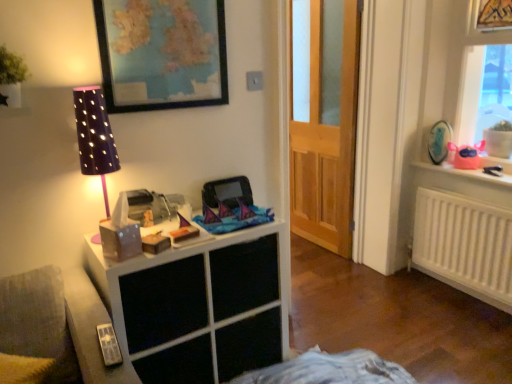
Question: Considering the relative sizes of gold metallic picture frame at upper right, which is the 1th picture frame from right to left, and pink plastic toy at upper right in the image provided, is gold metallic picture frame at upper right, which is the 1th picture frame from right to left, thinner than pink plastic toy at upper right?

Choices:
 (A) no
 (B) yes

Answer: (B)

Question: From a real-world perspective, is gold metallic picture frame at upper right, acting as the 3th picture frame starting from the bottom, located higher than pink plastic toy at upper right?

Choices:
 (A) no
 (B) yes

Answer: (B)

Question: Does gold metallic picture frame at upper right, arranged as the 2th picture frame when viewed from the front, have a lesser height compared to pink plastic toy at upper right?

Choices:
 (A) yes
 (B) no

Answer: (A)

Question: Is gold metallic picture frame at upper right, positioned as the second picture frame in back-to-front order, facing towards pink plastic toy at upper right?

Choices:
 (A) no
 (B) yes

Answer: (B)

Question: Is gold metallic picture frame at upper right, the third picture frame in the left-to-right sequence, to the right of pink plastic toy at upper right from the viewer's perspective?

Choices:
 (A) no
 (B) yes

Answer: (A)

Question: Relative to white matte radiator at right, is wooden door at center in front or behind?

Choices:
 (A) front
 (B) behind

Answer: (B)

Question: In terms of size, does wooden door at center appear bigger or smaller than white matte radiator at right?

Choices:
 (A) small
 (B) big

Answer: (B)

Question: Visually, is wooden door at center positioned to the left or to the right of white matte radiator at right?

Choices:
 (A) left
 (B) right

Answer: (A)

Question: From the image's perspective, is wooden door at center positioned above or below white matte radiator at right?

Choices:
 (A) above
 (B) below

Answer: (A)

Question: In terms of height, does purple dotted fabric at left look taller or shorter compared to white matte radiator at right?

Choices:
 (A) short
 (B) tall

Answer: (A)

Question: From the image's perspective, relative to white matte radiator at right, is purple dotted fabric at left above or below?

Choices:
 (A) below
 (B) above

Answer: (B)

Question: Is point (109, 152) positioned closer to the camera than point (421, 261)?

Choices:
 (A) farther
 (B) closer

Answer: (B)

Question: Is purple dotted fabric at left to the left or to the right of white matte radiator at right in the image?

Choices:
 (A) left
 (B) right

Answer: (A)

Question: From a real-world perspective, is wooden framed map at upper center, placed as the third picture frame when sorted from back to front, physically located above or below purple dotted fabric at left?

Choices:
 (A) above
 (B) below

Answer: (A)

Question: From the image's perspective, is wooden framed map at upper center, placed as the third picture frame when sorted from back to front, above or below purple dotted fabric at left?

Choices:
 (A) below
 (B) above

Answer: (B)